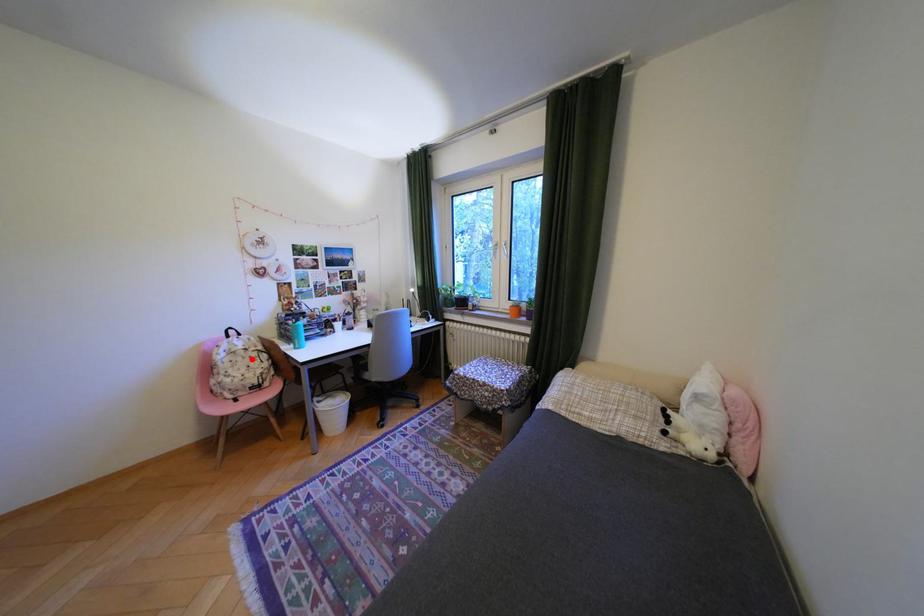
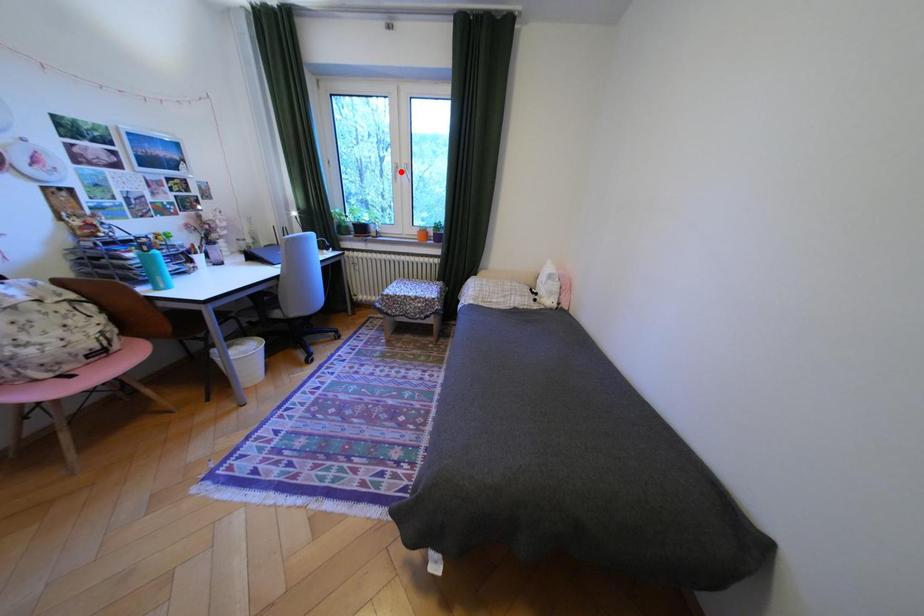
I am providing you with two images of the same scene from different viewpoints. A red point is marked on the first image and another point is marked on the second image. Is the marked point in image1 the same physical position as the marked point in image2?

No